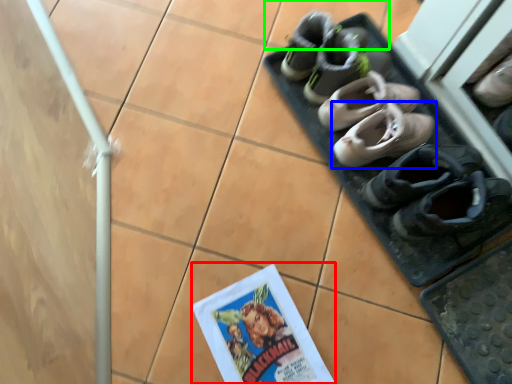
Question: Estimate the real-world distances between objects in this image. Which object is closer to comic book (highlighted by a red box), footwear (highlighted by a blue box) or tile (highlighted by a green box)?

Choices:
 (A) footwear
 (B) tile

Answer: (A)